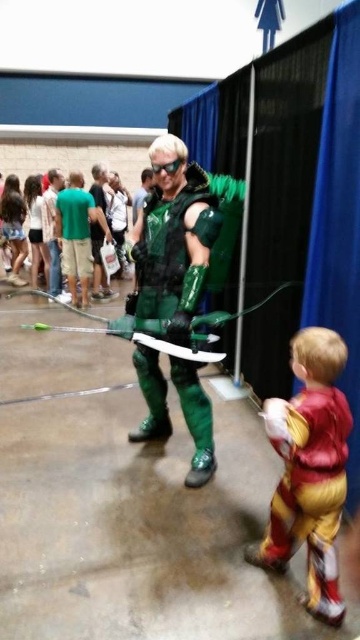
Does green shiny costume at center have a greater height compared to green metallic armor at center?

Indeed, green shiny costume at center has a greater height compared to green metallic armor at center.

Which is above, green shiny costume at center or green metallic armor at center?

Positioned higher is green metallic armor at center.

Does point (195, 246) come closer to viewer compared to point (104, 192)?

Yes.

The width and height of the screenshot is (360, 640). In order to click on green shiny costume at center in this screenshot , I will do `click(173, 240)`.

Who is higher up, green shiny costume at center or shiny yellow costume at lower right?

green shiny costume at center is above.

Which is below, green shiny costume at center or shiny yellow costume at lower right?

shiny yellow costume at lower right is lower down.

Between point (194, 467) and point (348, 432), which one is positioned in front?

Point (348, 432) is in front.

You are a GUI agent. You are given a task and a screenshot of the screen. Output one action in this format:
    pyautogui.click(x=<x>, y=<y>)
    Task: Click on the green shiny costume at center
    The height and width of the screenshot is (640, 360).
    Given the screenshot: What is the action you would take?
    coord(173,240)

How distant is shiny yellow costume at lower right from green metallic armor at center?

The distance of shiny yellow costume at lower right from green metallic armor at center is 15.63 feet.

Is shiny yellow costume at lower right above green metallic armor at center?

Actually, shiny yellow costume at lower right is below green metallic armor at center.

Locate an element on the screen. The height and width of the screenshot is (640, 360). shiny yellow costume at lower right is located at coordinates (309, 470).

Where is `shiny yellow costume at lower right`? This screenshot has width=360, height=640. shiny yellow costume at lower right is located at coordinates (309, 470).